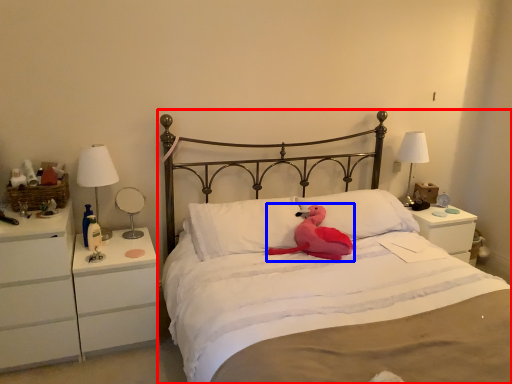
Question: Among these objects, which one is nearest to the camera, bed (highlighted by a red box) or animal (highlighted by a blue box)?

Choices:
 (A) bed
 (B) animal

Answer: (A)